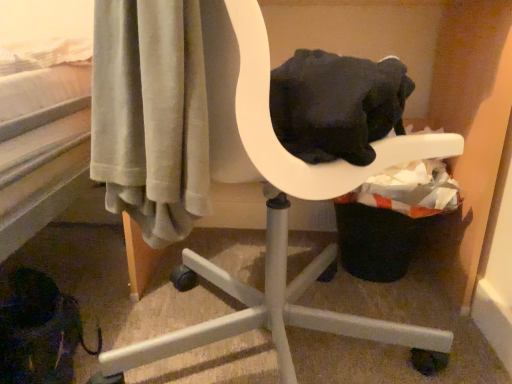
This screenshot has height=384, width=512. I want to click on black fabric laundry basket at lower right, so click(387, 221).

What do you see at coordinates (387, 221) in the screenshot? I see `black fabric laundry basket at lower right` at bounding box center [387, 221].

Describe the element at coordinates (273, 202) in the screenshot. I see `white plastic chair at center` at that location.

Find the location of a particular element. The width and height of the screenshot is (512, 384). white plastic chair at center is located at coordinates (273, 202).

Measure the distance between point (463, 145) and camera.

Point (463, 145) and camera are 22.99 inches apart from each other.

Where is `black fabric laundry basket at lower right`? The width and height of the screenshot is (512, 384). black fabric laundry basket at lower right is located at coordinates (387, 221).

Which object is positioned more to the right, black fabric laundry basket at lower right or white plastic chair at center?

black fabric laundry basket at lower right is more to the right.

Relative to white plastic chair at center, is black fabric laundry basket at lower right in front or behind?

Visually, black fabric laundry basket at lower right is located behind white plastic chair at center.

Is point (391, 178) more distant than point (345, 186)?

That is True.

From the image's perspective, who appears lower, black fabric laundry basket at lower right or white plastic chair at center?

black fabric laundry basket at lower right, from the image's perspective.

From a real-world perspective, between black fabric laundry basket at lower right and white plastic chair at center, who is vertically higher?

In real-world perspective, white plastic chair at center is above.

Based on the photo, considering the sizes of objects black fabric laundry basket at lower right and white plastic chair at center in the image provided, who is thinner, black fabric laundry basket at lower right or white plastic chair at center?

With smaller width is black fabric laundry basket at lower right.

Considering the sizes of objects black fabric laundry basket at lower right and white plastic chair at center in the image provided, who is taller, black fabric laundry basket at lower right or white plastic chair at center?

white plastic chair at center is taller.

Which of these two, black fabric laundry basket at lower right or white plastic chair at center, is bigger?

With larger size is white plastic chair at center.

Is black fabric laundry basket at lower right located outside white plastic chair at center?

No.

Is black fabric laundry basket at lower right positioned far away from white plastic chair at center?

No, there isn't a large distance between black fabric laundry basket at lower right and white plastic chair at center.

Is black fabric laundry basket at lower right aimed at white plastic chair at center?

Yes, black fabric laundry basket at lower right is aimed at white plastic chair at center.

The height and width of the screenshot is (384, 512). Find the location of `laundry basket on the right of the white plastic chair at center`. laundry basket on the right of the white plastic chair at center is located at coordinates (387, 221).

Considering the positions of objects white plastic chair at center and black fabric laundry basket at lower right in the image provided, who is more to the left, white plastic chair at center or black fabric laundry basket at lower right?

Positioned to the left is white plastic chair at center.

Considering their positions, is white plastic chair at center located in front of or behind black fabric laundry basket at lower right?

white plastic chair at center is positioned closer to the viewer than black fabric laundry basket at lower right.

Is point (327, 328) closer or farther from the camera than point (346, 229)?

Point (327, 328) appears to be closer to the viewer than point (346, 229).

From the image's perspective, is white plastic chair at center below black fabric laundry basket at lower right?

No.

Consider the image. From a real-world perspective, is white plastic chair at center located beneath black fabric laundry basket at lower right?

No, from a real-world perspective, white plastic chair at center is not under black fabric laundry basket at lower right.

From the picture: Which object is wider, white plastic chair at center or black fabric laundry basket at lower right?

white plastic chair at center.

Which of these two, white plastic chair at center or black fabric laundry basket at lower right, stands shorter?

With less height is black fabric laundry basket at lower right.

Can you confirm if white plastic chair at center is smaller than black fabric laundry basket at lower right?

No.

Do you think white plastic chair at center is within black fabric laundry basket at lower right, or outside of it?

white plastic chair at center is not enclosed by black fabric laundry basket at lower right.

Is white plastic chair at center far from black fabric laundry basket at lower right?

That's not correct — white plastic chair at center is a little close to black fabric laundry basket at lower right.

Is black fabric laundry basket at lower right at the back of white plastic chair at center?

Yes.

What's the angular difference between white plastic chair at center and black fabric laundry basket at lower right's facing directions?

They differ by 0.000561 degrees in their facing directions.

Locate an element on the screen. Image resolution: width=512 pixels, height=384 pixels. chair lying on the left of black fabric laundry basket at lower right is located at coordinates (273, 202).

The width and height of the screenshot is (512, 384). I want to click on laundry basket on the right of white plastic chair at center, so click(387, 221).

Image resolution: width=512 pixels, height=384 pixels. In order to click on chair in front of the black fabric laundry basket at lower right in this screenshot , I will do `click(273, 202)`.